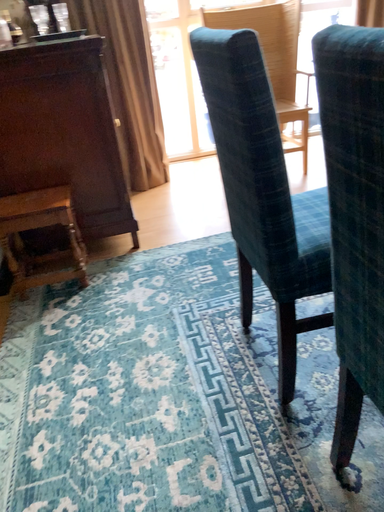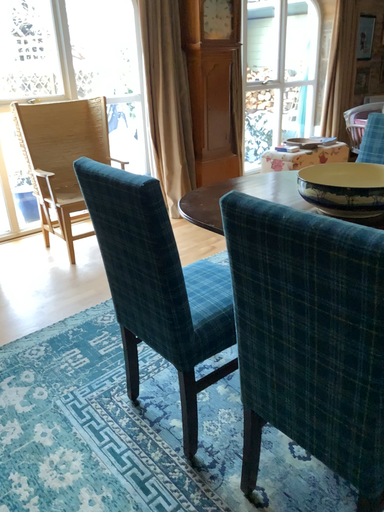
Question: Which way did the camera rotate in the video?

Choices:
 (A) rotated right
 (B) rotated left

Answer: (A)